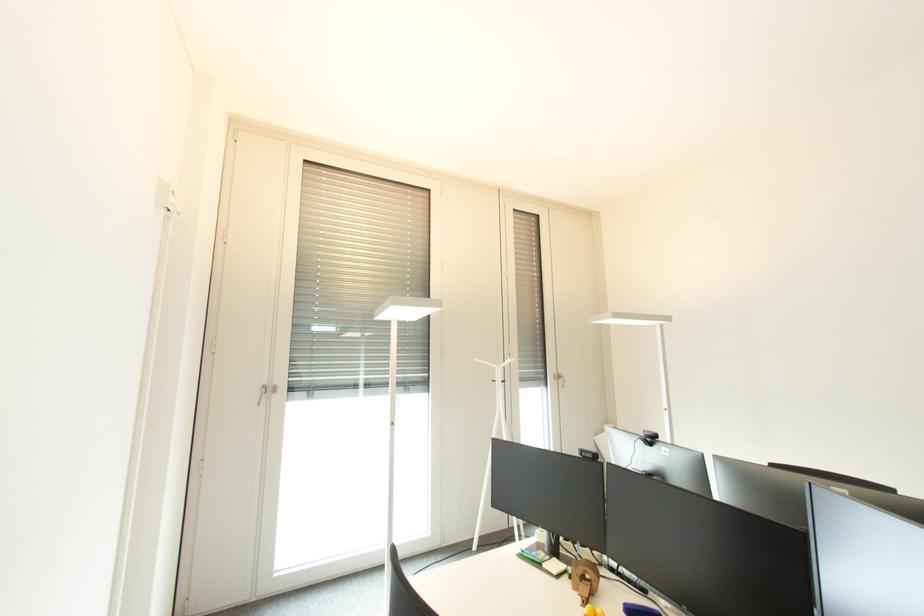
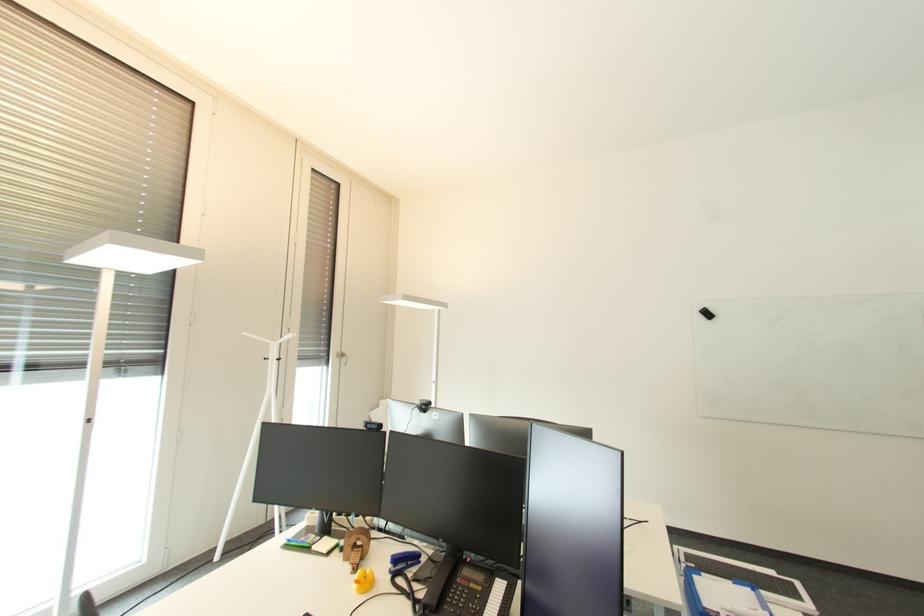
Question: How did the camera likely rotate?

Choices:
 (A) Left
 (B) Right
 (C) Up
 (D) Down

Answer: (B)